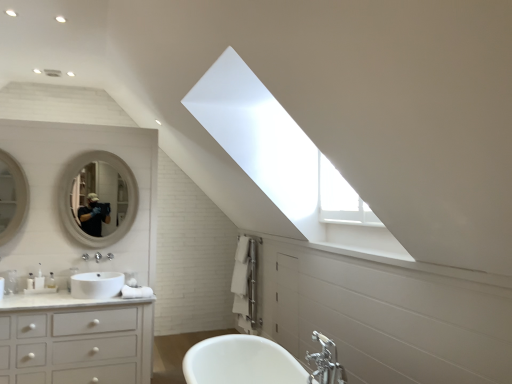
Question: Is point (230, 362) positioned closer to the camera than point (12, 215)?

Choices:
 (A) closer
 (B) farther

Answer: (A)

Question: Visually, is white glossy bathtub at center positioned to the left or to the right of matte white mirror at left, which is the second mirror from right to left?

Choices:
 (A) left
 (B) right

Answer: (B)

Question: Based on their relative distances, which object is farther from the white matte cabinet at lower left?

Choices:
 (A) white glossy mirror at upper left, which ranks as the 2th mirror in front-to-back order
 (B) matte white mirror at left, the 1th mirror positioned from the front
 (C) white glossy sink at lower left
 (D) white glossy bathtub at center
 (E) chrome metallic faucet at lower center

Answer: (E)

Question: Which is farther from the white glossy sink at lower left?

Choices:
 (A) white glossy bathtub at center
 (B) matte white mirror at left, acting as the first mirror starting from the left
 (C) white glossy mirror at upper left, acting as the 1th mirror starting from the back
 (D) white matte cabinet at lower left
 (E) chrome metallic faucet at lower center

Answer: (E)